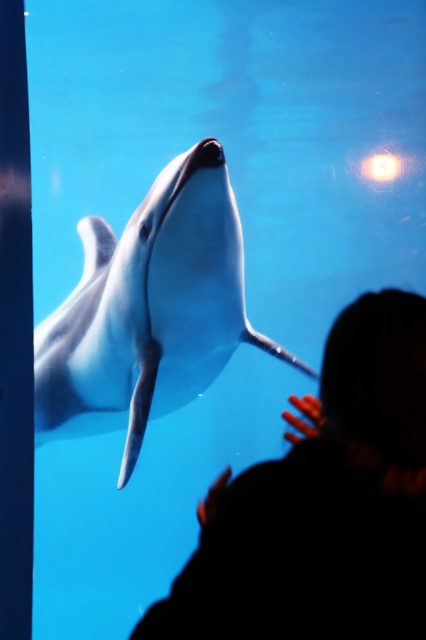
You are a visitor at the aquarium and notice the silhouette hair at upper center and the white smooth dolphin at center in the tank. Which object is positioned to the right side of the other?

The silhouette hair at upper center is to the right of the white smooth dolphin at center.

You are a marine biologist observing the aquarium. You notice the silhouette hair at upper center and the white smooth dolphin at center. Which object is larger in size?

The white smooth dolphin at center is larger than the silhouette hair at upper center.

You are a visitor at the aquarium and see the silhouette hair at upper center and the white smooth dolphin at center. Which object is positioned lower in the image?

The silhouette hair at upper center is below the white smooth dolphin at center, so the silhouette hair at upper center is positioned lower in the image.